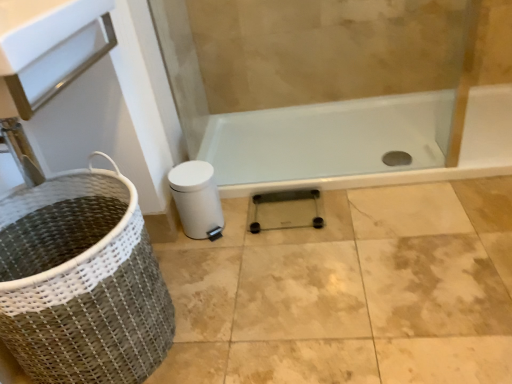
Identify the location of vacant space underneath transparent glass scale at center (from a real-world perspective). (290, 220).